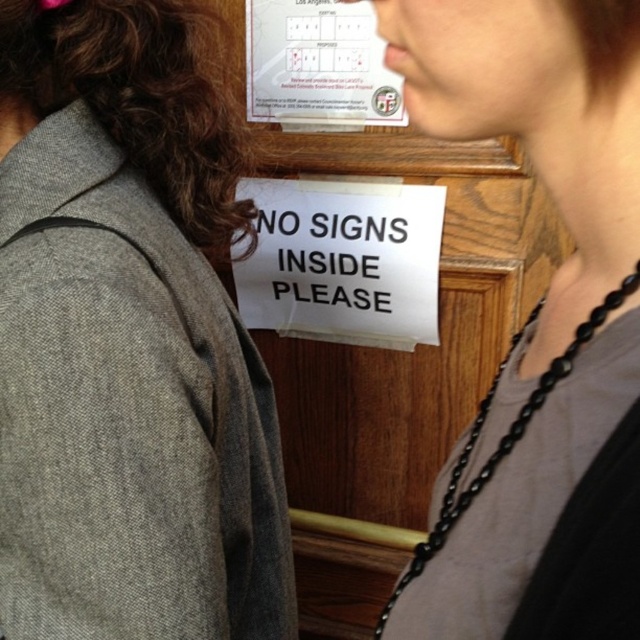
Can you confirm if white paper sign at center is taller than white paper poster at upper center?

Indeed, white paper sign at center has a greater height compared to white paper poster at upper center.

Which is in front, point (438, 241) or point (282, 0)?

Positioned in front is point (438, 241).

Where is `white paper sign at center`? This screenshot has height=640, width=640. white paper sign at center is located at coordinates (342, 260).

Who is positioned more to the right, gray woolen jacket at left or brown curly hair at upper left?

gray woolen jacket at left is more to the right.

Where is `gray woolen jacket at left`? gray woolen jacket at left is located at coordinates (128, 340).

You are a GUI agent. You are given a task and a screenshot of the screen. Output one action in this format:
    pyautogui.click(x=<x>, y=<y>)
    Task: Click on the gray woolen jacket at left
    Image resolution: width=640 pixels, height=640 pixels.
    Given the screenshot: What is the action you would take?
    pyautogui.click(x=128, y=340)

You are a GUI agent. You are given a task and a screenshot of the screen. Output one action in this format:
    pyautogui.click(x=<x>, y=<y>)
    Task: Click on the gray woolen jacket at left
    This screenshot has width=640, height=640.
    Given the screenshot: What is the action you would take?
    pyautogui.click(x=128, y=340)

Measure the distance between point [516,449] and camera.

Point [516,449] is 12.46 inches from camera.

Does matte black necklace at upper right have a larger size compared to brown curly hair at upper left?

Yes.

This screenshot has width=640, height=640. In order to click on matte black necklace at upper right in this screenshot , I will do `click(538, 326)`.